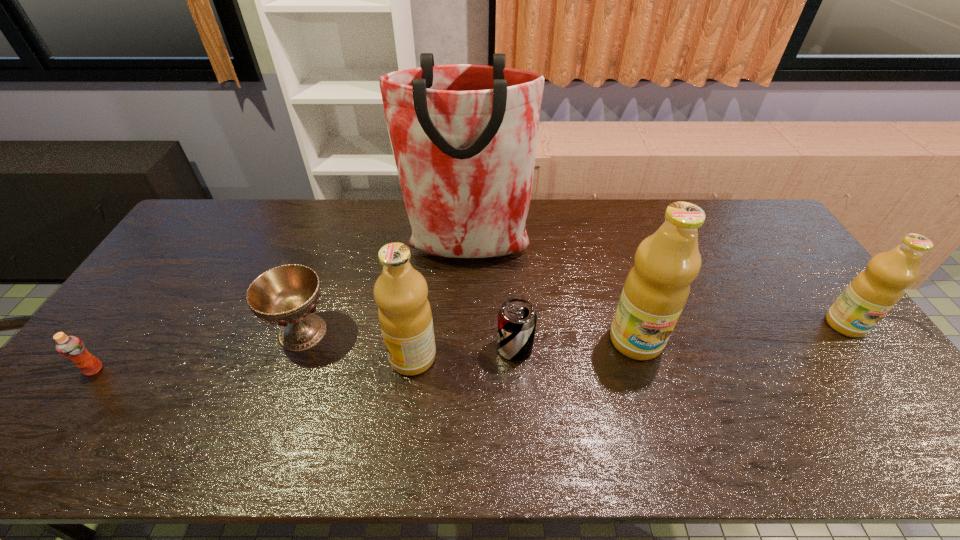
Please point a spot to add another olive oil on the left. Please provide its 2D coordinates. Your answer should be formatted as a tuple, i.e. [(x, y)], where the tuple contains the x and y coordinates of a point satisfying the conditions above.

[(174, 375)]